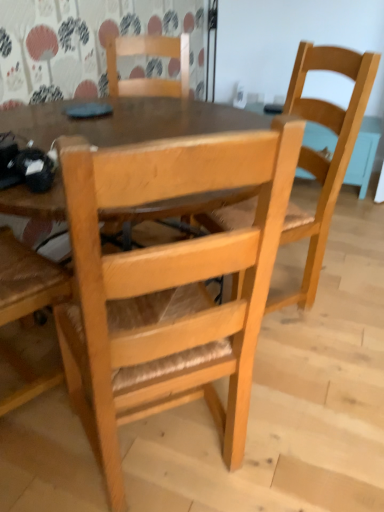
Question: Is natural wood chair at right, the 2th chair when ordered from front to back, turned away from natural wood chair at center, which appears as the third chair when viewed from the back?

Choices:
 (A) no
 (B) yes

Answer: (A)

Question: Is natural wood chair at right, the second chair viewed from the back, positioned beyond the bounds of natural wood chair at center, the first chair positioned from the front?

Choices:
 (A) yes
 (B) no

Answer: (A)

Question: From a real-world perspective, is natural wood chair at right, the second chair viewed from the back, under natural wood chair at center, the first chair positioned from the front?

Choices:
 (A) no
 (B) yes

Answer: (A)

Question: Does natural wood chair at right, the 2th chair when ordered from front to back, come behind natural wood chair at center, the first chair positioned from the front?

Choices:
 (A) yes
 (B) no

Answer: (A)

Question: Is natural wood chair at right, the 2th chair when ordered from front to back, smaller than natural wood chair at center, the first chair positioned from the front?

Choices:
 (A) yes
 (B) no

Answer: (B)

Question: Considering the positions of point (100, 457) and point (112, 42), is point (100, 457) closer or farther from the camera than point (112, 42)?

Choices:
 (A) closer
 (B) farther

Answer: (A)

Question: Considering their positions, is natural wood chair at center, the first chair positioned from the front, located in front of or behind natural wood chair at center, arranged as the first chair when viewed from the back?

Choices:
 (A) behind
 (B) front

Answer: (B)

Question: From a real-world perspective, is natural wood chair at center, which appears as the third chair when viewed from the back, physically located above or below natural wood chair at center, the 3th chair from the front?

Choices:
 (A) below
 (B) above

Answer: (A)

Question: Considering the relative positions of natural wood chair at center, the first chair positioned from the front, and natural wood chair at center, arranged as the first chair when viewed from the back, in the image provided, is natural wood chair at center, the first chair positioned from the front, to the left or to the right of natural wood chair at center, arranged as the first chair when viewed from the back,?

Choices:
 (A) right
 (B) left

Answer: (A)

Question: Is natural wood chair at right, the 2th chair when ordered from front to back, situated inside natural wood chair at center, the first chair positioned from the front, or outside?

Choices:
 (A) outside
 (B) inside

Answer: (A)

Question: In terms of height, does natural wood chair at right, the 2th chair when ordered from front to back, look taller or shorter compared to natural wood chair at center, which appears as the third chair when viewed from the back?

Choices:
 (A) tall
 (B) short

Answer: (A)

Question: Based on their positions, is natural wood chair at right, the 2th chair when ordered from front to back, located to the left or right of natural wood chair at center, the first chair positioned from the front?

Choices:
 (A) right
 (B) left

Answer: (A)

Question: Is point (321, 172) closer or farther from the camera than point (74, 208)?

Choices:
 (A) closer
 (B) farther

Answer: (B)

Question: Considering the positions of point (180, 66) and point (319, 221), is point (180, 66) closer or farther from the camera than point (319, 221)?

Choices:
 (A) farther
 (B) closer

Answer: (A)

Question: Considering the positions of natural wood chair at center, arranged as the first chair when viewed from the back, and natural wood chair at right, the 2th chair when ordered from front to back, in the image, is natural wood chair at center, arranged as the first chair when viewed from the back, bigger or smaller than natural wood chair at right, the 2th chair when ordered from front to back,?

Choices:
 (A) small
 (B) big

Answer: (A)